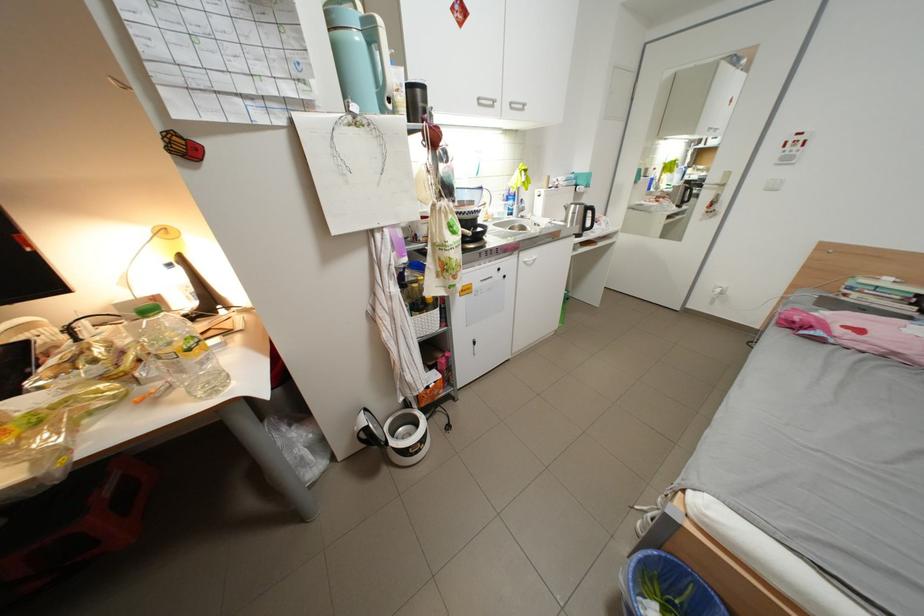
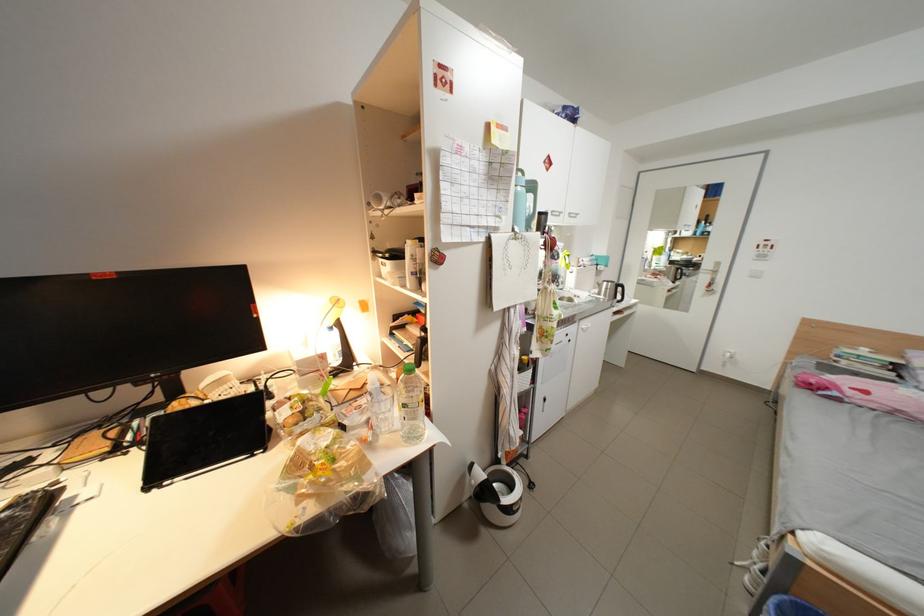
Locate, in the second image, the point that corresponds to (867,296) in the first image.

(856, 363)